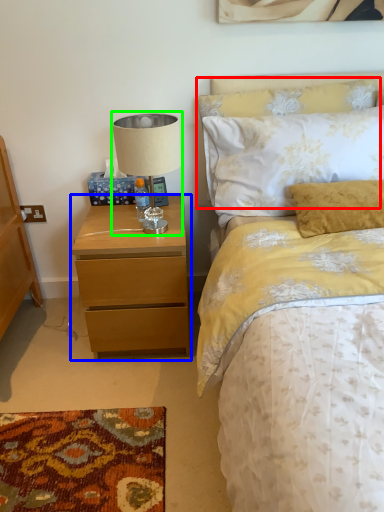
Question: Considering the real-world distances, which object is closest to pillow (highlighted by a red box)? nightstand (highlighted by a blue box) or table lamp (highlighted by a green box).

Choices:
 (A) nightstand
 (B) table lamp

Answer: (B)